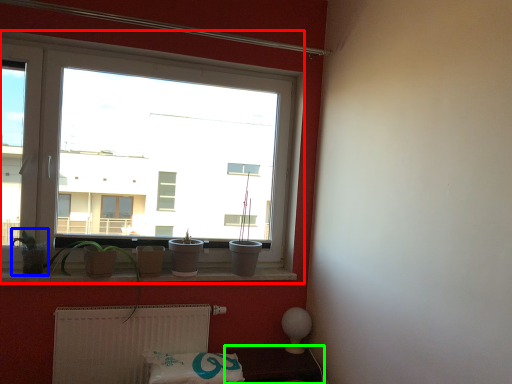
Question: Which object is positioned farthest from window (highlighted by a red box)? Select from plant (highlighted by a blue box) and furniture (highlighted by a green box).

Choices:
 (A) plant
 (B) furniture

Answer: (B)